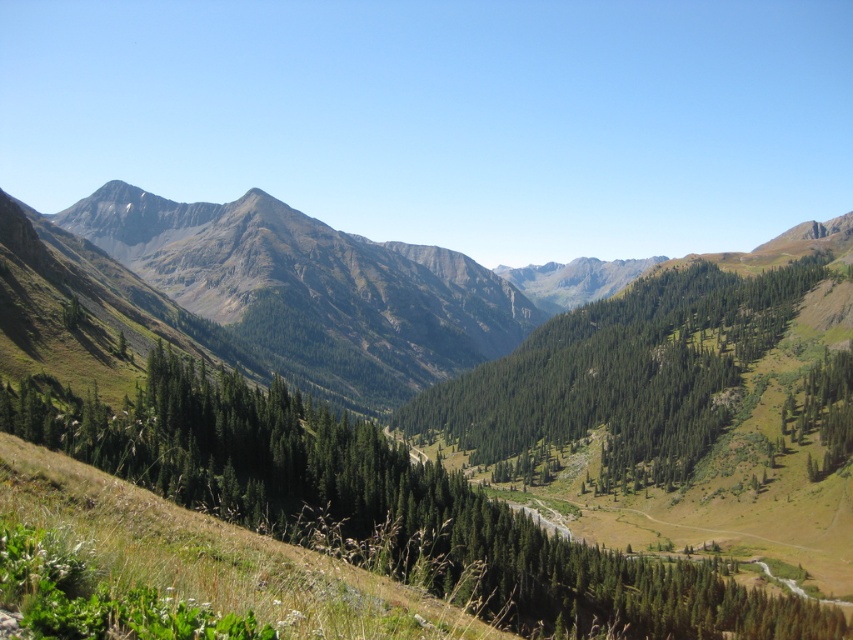
Between point (184, 344) and point (648, 330), which one is positioned in front?

Positioned in front is point (184, 344).

Does green grassy mountain at center appear over green textured trees at center?

Correct, green grassy mountain at center is located above green textured trees at center.

Does point (184, 320) come closer to viewer compared to point (614, 461)?

No, it is behind (614, 461).

Image resolution: width=853 pixels, height=640 pixels. Find the location of `green grassy mountain at center`. green grassy mountain at center is located at coordinates (312, 458).